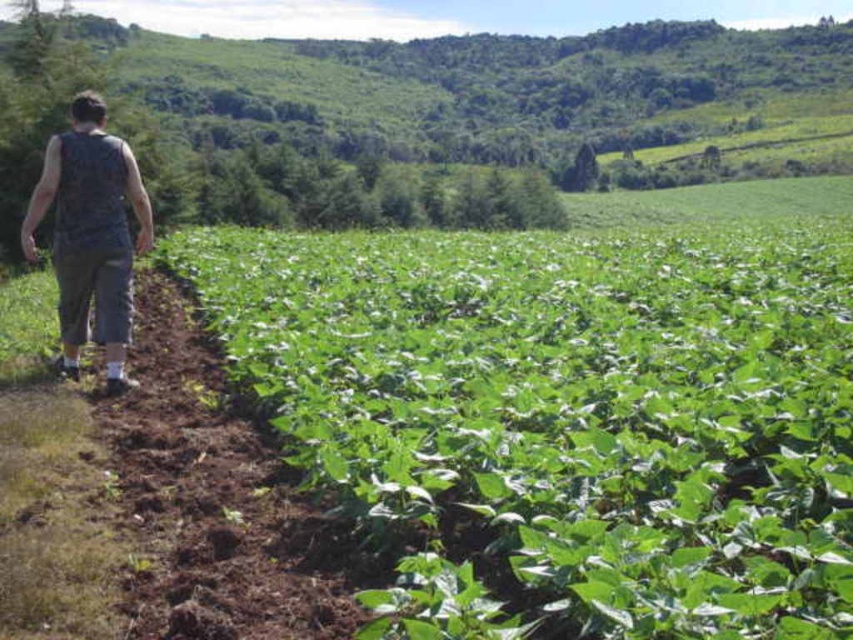
You are standing in the field and see the green leafy hillside at upper left and the dark gray sleeveless shirt at left. Which object is positioned to the right of the other?

The green leafy hillside at upper left is to the right of the dark gray sleeveless shirt at left.

You are standing at the edge of the field and want to reach a specific point marked at coordinates point (734, 484). If your walking speed is 3 feet per second, how many seconds will it take you to reach that point?

The distance of point (734, 484) from viewer is 14.23 feet. At a speed of 3 feet per second, it will take 14.23 divided by 3, which is approximately 4.74 seconds to reach the point.